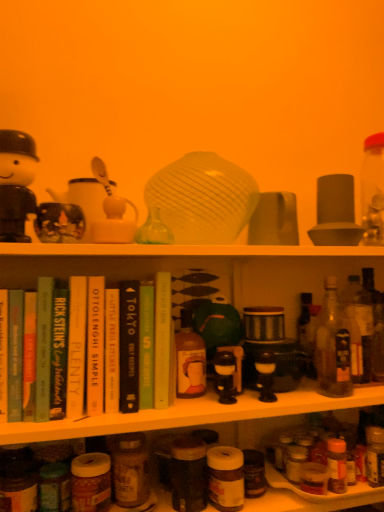
Locate an element on the screen. The width and height of the screenshot is (384, 512). free space in front of translucent glass bottle at center, which is counted as the 2th bottle, starting from the left is located at coordinates [188, 409].